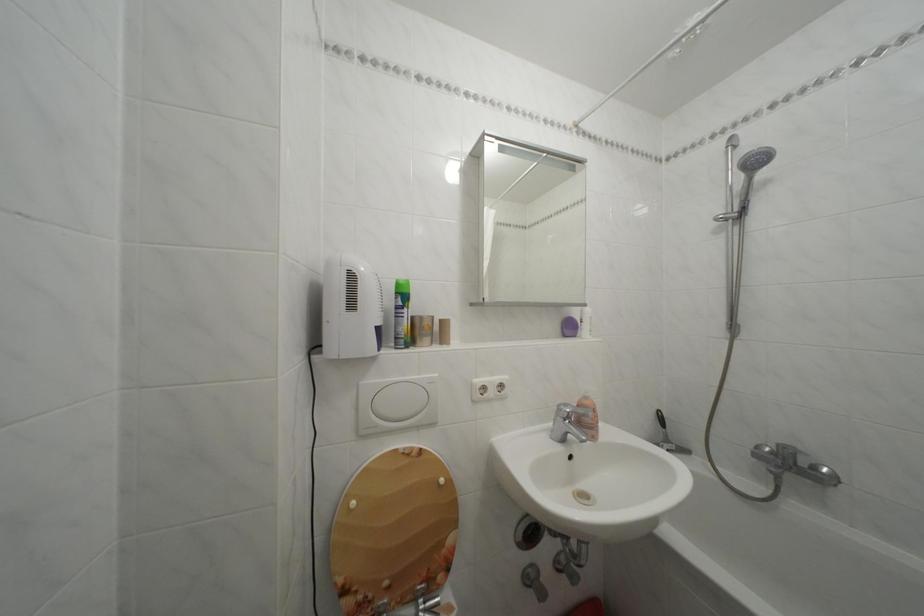
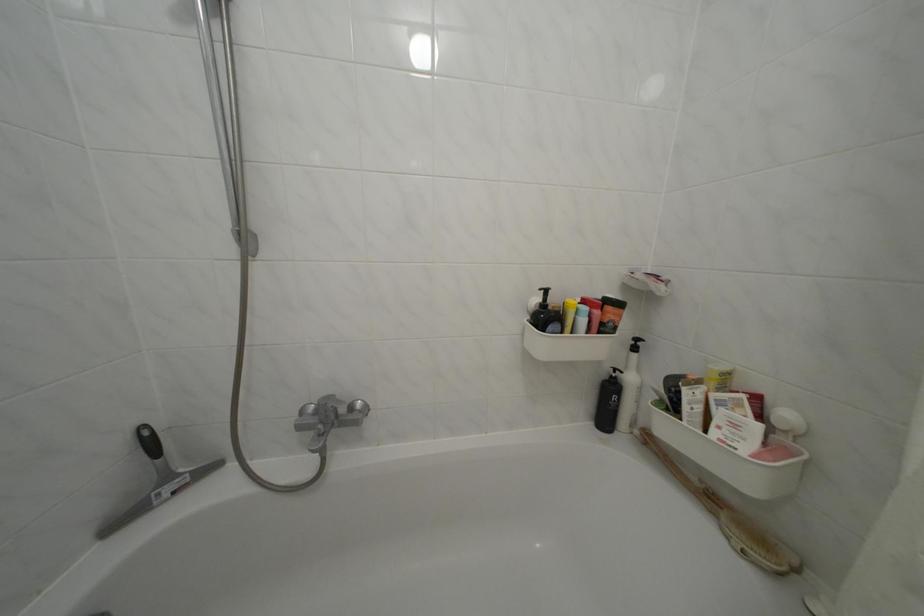
Question: The camera is either moving clockwise (left) or counter-clockwise (right) around the object. The first image is from the beginning of the video and the second image is from the end. Is the camera moving left or right when shooting the video?

Choices:
 (A) Left
 (B) Right

Answer: (A)